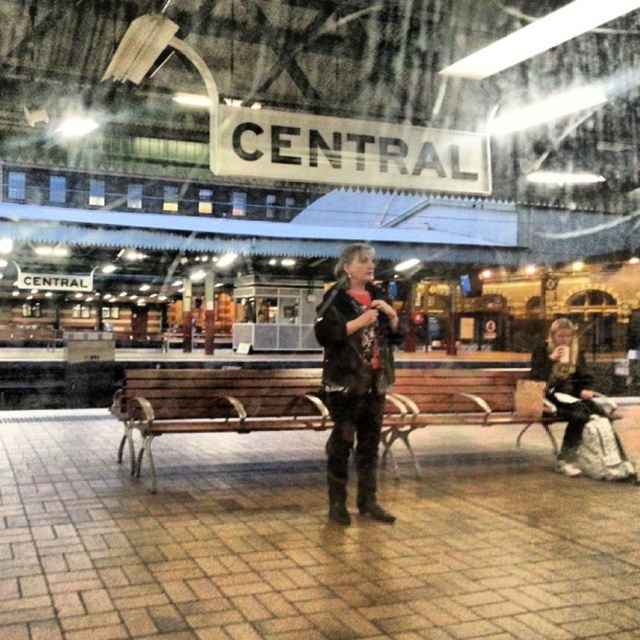
Between brown wooden bench at center and leather jacket at center, which one has more height?

leather jacket at center is taller.

How far apart are brown wooden bench at center and leather jacket at center?

The distance of brown wooden bench at center from leather jacket at center is 37.71 inches.

Is point (136, 371) more distant than point (332, 454)?

That is True.

You are a GUI agent. You are given a task and a screenshot of the screen. Output one action in this format:
    pyautogui.click(x=<x>, y=<y>)
    Task: Click on the brown wooden bench at center
    Image resolution: width=640 pixels, height=640 pixels.
    Given the screenshot: What is the action you would take?
    pyautogui.click(x=214, y=404)